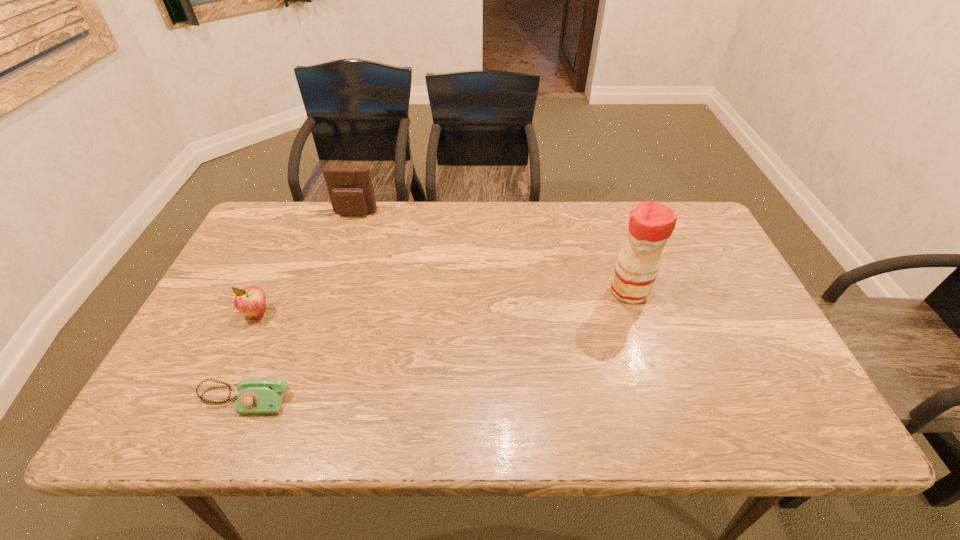
This screenshot has width=960, height=540. What are the coordinates of `vacant region at the far right corner of the desktop` in the screenshot? It's located at (696, 224).

Locate an element on the screen. vacant area that lies between the telephone and the apple is located at coordinates (251, 356).

At what (x,y) coordinates should I click in order to perform the action: click on free area in between the nearest object and the third tallest object. Please return your answer as a coordinate pair (x, y). Looking at the image, I should click on (251, 356).

What are the coordinates of `vacant region between the rightmost object and the shortest object` in the screenshot? It's located at (436, 345).

You are a GUI agent. You are given a task and a screenshot of the screen. Output one action in this format:
    pyautogui.click(x=<x>, y=<y>)
    Task: Click on the vacant point located between the telephone and the third shortest object
    
    Given the screenshot: What is the action you would take?
    pyautogui.click(x=300, y=306)

Find the location of a particular element. The height and width of the screenshot is (540, 960). vacant space in between the condiment and the second shortest object is located at coordinates (444, 302).

This screenshot has width=960, height=540. Identify the location of vacant area between the third shortest object and the nearest object. (300, 306).

This screenshot has width=960, height=540. Identify the location of vacant area between the farthest object and the rightmost object. (492, 252).

This screenshot has width=960, height=540. Find the location of `free spot between the nearest object and the third tallest object`. free spot between the nearest object and the third tallest object is located at coordinates (251, 356).

I want to click on unoccupied position between the third shortest object and the apple, so click(x=306, y=264).